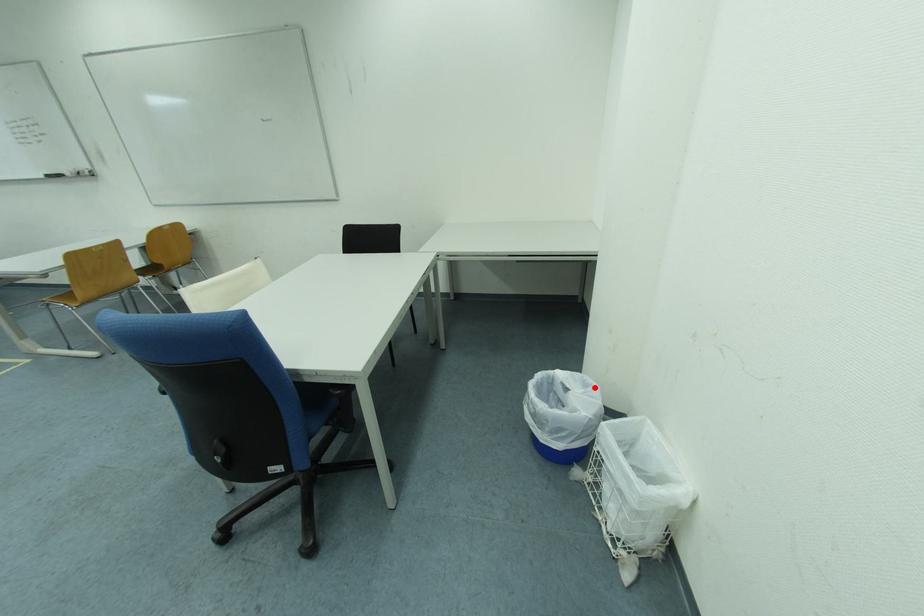
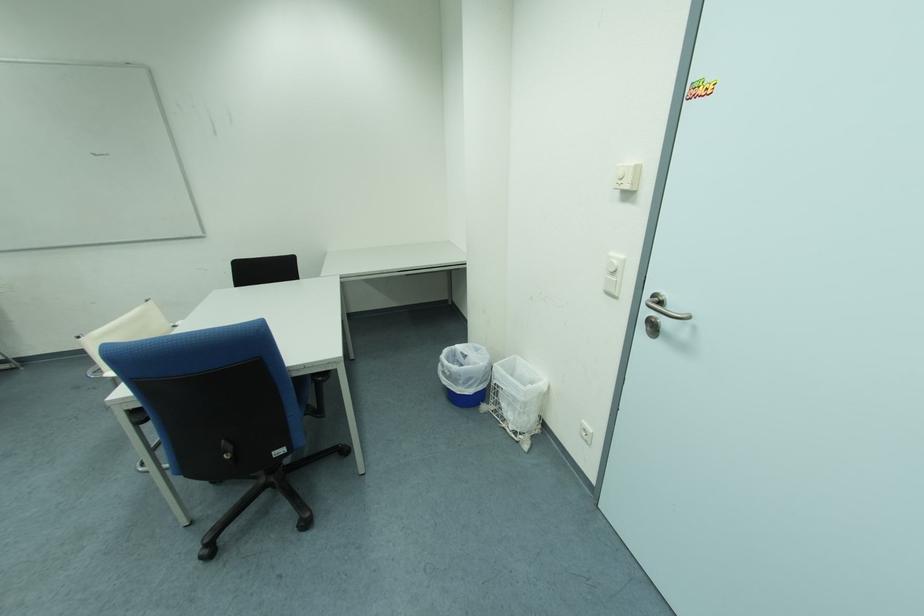
Question: I am providing you with two images of the same scene from different viewpoints. Image1 has a red point marked. In image2, the corresponding 3D location appears at what relative position? Reply with the corresponding letter.

Choices:
 (A) Closer
 (B) Farther

Answer: (B)